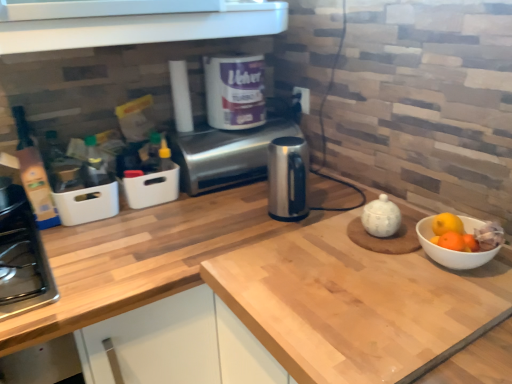
Where is `light wood countertop at center`? The height and width of the screenshot is (384, 512). light wood countertop at center is located at coordinates (144, 258).

I want to click on white glossy tea pot at center-right, so click(x=381, y=217).

From the picture: Can you confirm if satin silver toaster at center is bigger than white glossy tea pot at center-right?

Yes, satin silver toaster at center is bigger than white glossy tea pot at center-right.

Where is `oven that appears on the left of white glossy tea pot at center-right`? The image size is (512, 384). oven that appears on the left of white glossy tea pot at center-right is located at coordinates (225, 155).

Does satin silver toaster at center appear on the right side of white glossy tea pot at center-right?

No.

Is satin silver toaster at center oriented away from black plastic electric outlet at upper center?

No, satin silver toaster at center is not facing the opposite direction of black plastic electric outlet at upper center.

How much distance is there between satin silver toaster at center and black plastic electric outlet at upper center?

satin silver toaster at center and black plastic electric outlet at upper center are 13.67 inches apart.

The image size is (512, 384). I want to click on electric outlet behind the satin silver toaster at center, so click(303, 98).

From the image's perspective, who appears lower, satin silver toaster at center or black plastic electric outlet at upper center?

From the image's view, satin silver toaster at center is below.

Does light wood countertop at center have a smaller size compared to white glossy tea pot at center-right?

Actually, light wood countertop at center might be larger than white glossy tea pot at center-right.

How distant is light wood countertop at center from white glossy tea pot at center-right?

light wood countertop at center is 14.71 inches away from white glossy tea pot at center-right.

Is light wood countertop at center taller or shorter than white glossy tea pot at center-right?

Clearly, light wood countertop at center is taller compared to white glossy tea pot at center-right.

From the image's perspective, does white glossy tea pot at center-right appear lower than satin silver toaster at center?

Yes.

Is white glossy tea pot at center-right turned away from satin silver toaster at center?

No, white glossy tea pot at center-right's orientation is not away from satin silver toaster at center.

From a real-world perspective, between white glossy tea pot at center-right and satin silver toaster at center, who is vertically higher?

satin silver toaster at center.

Does point (219, 189) appear closer or farther from the camera than point (150, 298)?

Point (219, 189) is positioned farther from the camera compared to point (150, 298).

Considering the sizes of objects satin silver toaster at center and light wood countertop at center in the image provided, who is wider, satin silver toaster at center or light wood countertop at center?

Wider between the two is light wood countertop at center.

Is satin silver toaster at center in contact with light wood countertop at center?

No, satin silver toaster at center is not with light wood countertop at center.

Is satin silver toaster at center oriented away from light wood countertop at center?

No, satin silver toaster at center is not facing away from light wood countertop at center.

Can you confirm if white glossy tea pot at center-right is taller than light wood countertop at center?

No, white glossy tea pot at center-right is not taller than light wood countertop at center.

Consider the image. Is white glossy tea pot at center-right at the right side of light wood countertop at center?

Yes.

Is white glossy tea pot at center-right in contact with light wood countertop at center?

white glossy tea pot at center-right and light wood countertop at center are not in contact.

Is black plastic electric outlet at upper center placed right next to light wood countertop at center?

No, black plastic electric outlet at upper center is not in contact with light wood countertop at center.

Considering the sizes of objects black plastic electric outlet at upper center and light wood countertop at center in the image provided, who is smaller, black plastic electric outlet at upper center or light wood countertop at center?

black plastic electric outlet at upper center is smaller.

Is black plastic electric outlet at upper center situated inside light wood countertop at center or outside?

black plastic electric outlet at upper center is not inside light wood countertop at center, it's outside.

Does black plastic electric outlet at upper center lie behind light wood countertop at center?

Yes, black plastic electric outlet at upper center is further from the camera.

This screenshot has width=512, height=384. In order to click on oven on the left of white glossy tea pot at center-right in this screenshot , I will do `click(225, 155)`.

Where is `electric outlet behind the satin silver toaster at center`? electric outlet behind the satin silver toaster at center is located at coordinates (303, 98).

When comparing their distances from white glossy tea pot at center-right, does black plastic electric outlet at upper center or light wood countertop at center seem further?

The object further to white glossy tea pot at center-right is black plastic electric outlet at upper center.

Considering their positions, is satin silver toaster at center positioned further to black plastic electric outlet at upper center than white glossy tea pot at center-right?

Based on the image, white glossy tea pot at center-right appears to be further to black plastic electric outlet at upper center.

Based on their spatial positions, is white glossy tea pot at center-right or black plastic electric outlet at upper center further from light wood countertop at center?

black plastic electric outlet at upper center lies further to light wood countertop at center than the other object.

Based on the photo, based on their spatial positions, is light wood countertop at center or white glossy tea pot at center-right closer to black plastic electric outlet at upper center?

white glossy tea pot at center-right is positioned closer to the anchor black plastic electric outlet at upper center.

Based on their spatial positions, is white glossy tea pot at center-right or light wood countertop at center closer to black plastic electric outlet at upper center?

Among the two, white glossy tea pot at center-right is located nearer to black plastic electric outlet at upper center.

Looking at the image, which one is located closer to light wood countertop at center, black plastic electric outlet at upper center or white glossy tea pot at center-right?

white glossy tea pot at center-right is positioned closer to the anchor light wood countertop at center.

When comparing their distances from light wood countertop at center, does satin silver toaster at center or white glossy tea pot at center-right seem further?

Based on the image, white glossy tea pot at center-right appears to be further to light wood countertop at center.

From the image, which object appears to be farther from white glossy tea pot at center-right, light wood countertop at center or satin silver toaster at center?

satin silver toaster at center is further to white glossy tea pot at center-right.

Image resolution: width=512 pixels, height=384 pixels. Identify the location of tea pot between light wood countertop at center and black plastic electric outlet at upper center in the front-back direction. (381, 217).

At what (x,y) coordinates should I click in order to perform the action: click on tea pot that lies between satin silver toaster at center and light wood countertop at center from top to bottom. Please return your answer as a coordinate pair (x, y). The width and height of the screenshot is (512, 384). Looking at the image, I should click on (381, 217).

Where is `oven between black plastic electric outlet at upper center and light wood countertop at center from top to bottom`? This screenshot has width=512, height=384. oven between black plastic electric outlet at upper center and light wood countertop at center from top to bottom is located at coordinates (225, 155).

What are the coordinates of `oven between white glossy tea pot at center-right and black plastic electric outlet at upper center from front to back` in the screenshot? It's located at (225, 155).